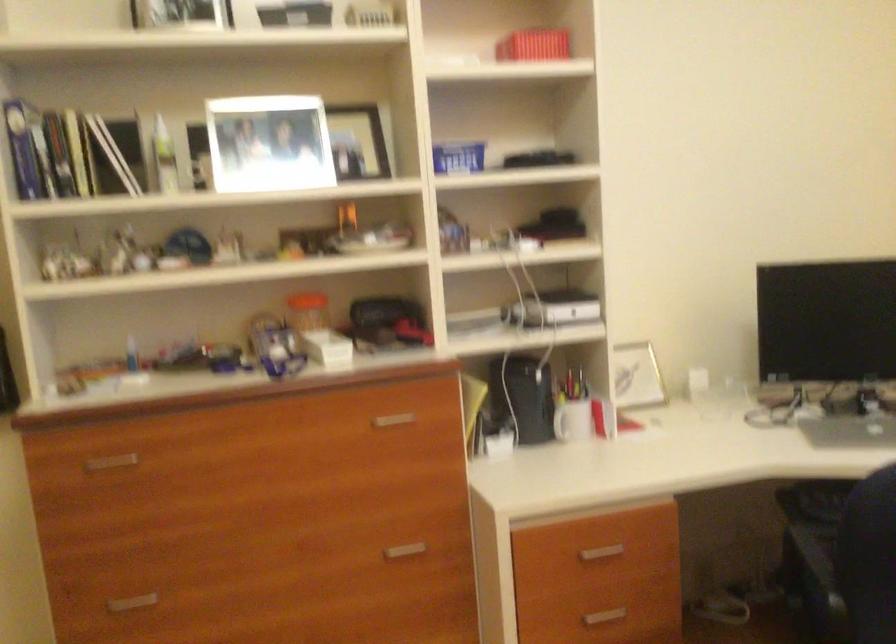
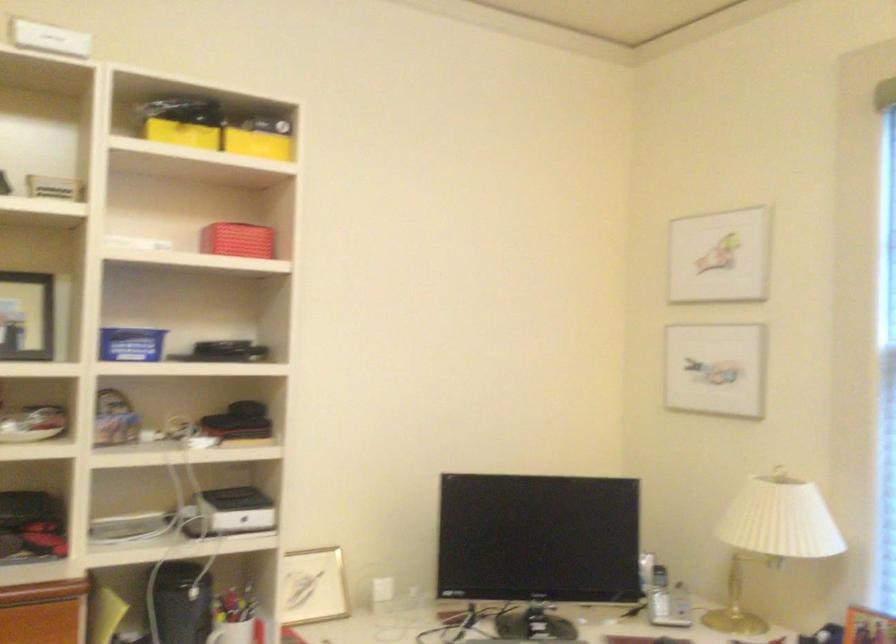
The point at (573, 411) is marked in the first image. Where is the corresponding point in the second image?

(231, 632)